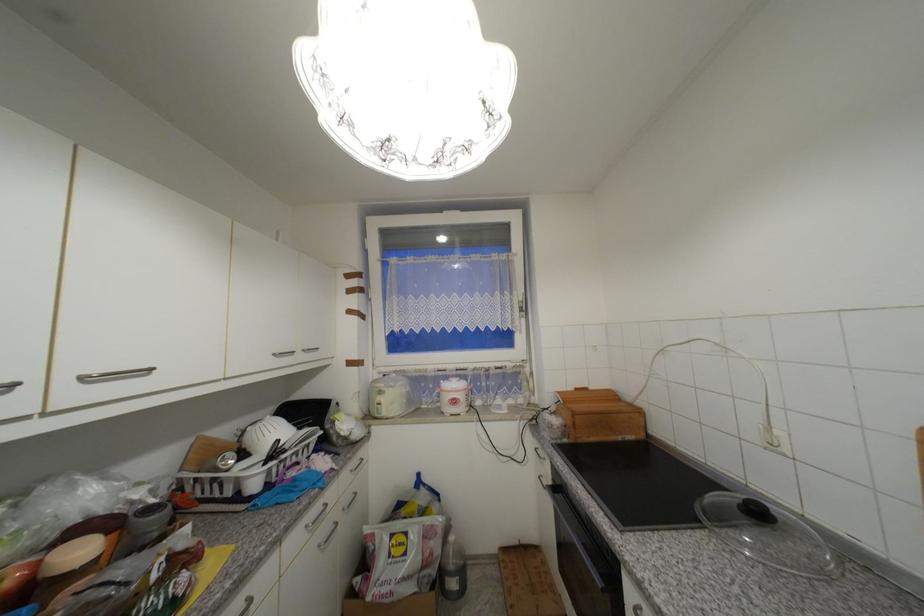
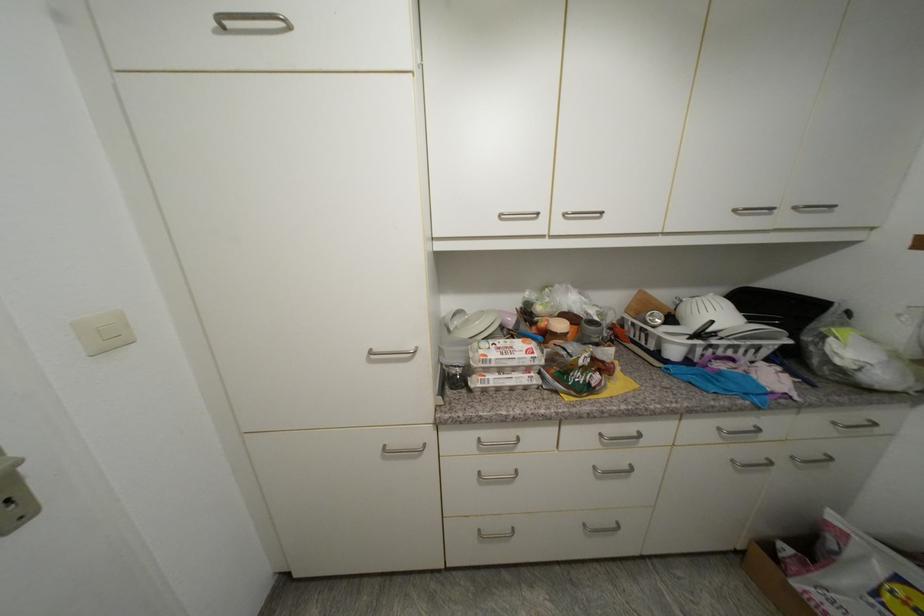
In the second image, find the point that corresponds to point (324, 546) in the first image.

(738, 463)